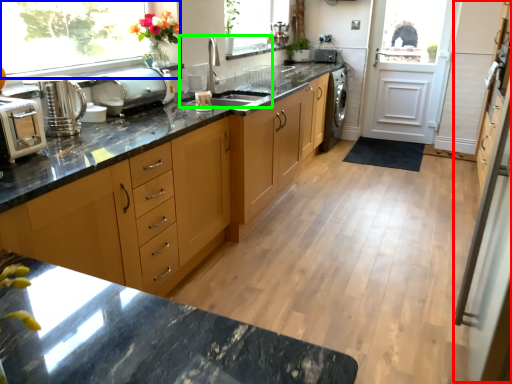
Question: Which is nearer to the screen door (highlighted by a red box)? window (highlighted by a blue box) or sink (highlighted by a green box).

Choices:
 (A) window
 (B) sink

Answer: (B)